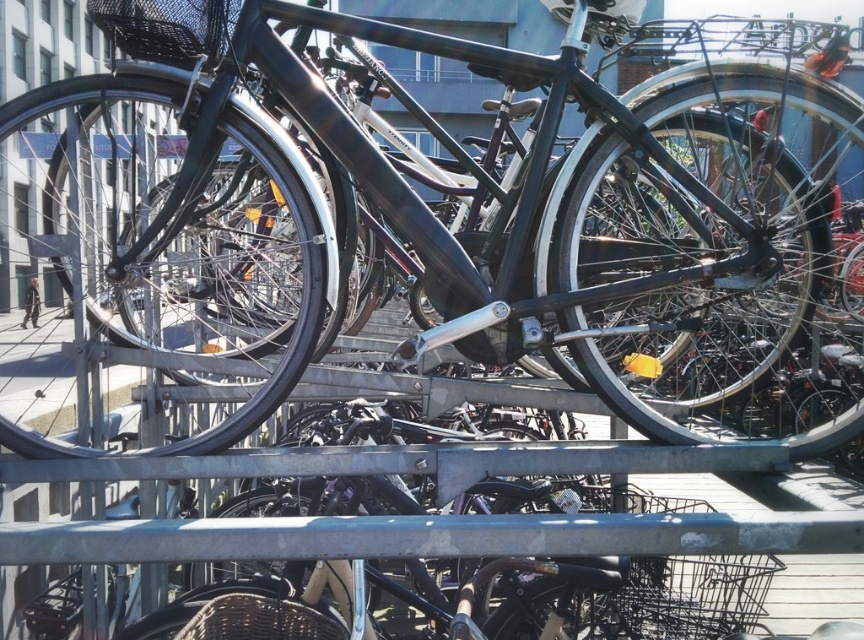
Is black mesh basket at upper left to the left of black woven basket at center from the viewer's perspective?

Yes, black mesh basket at upper left is to the left of black woven basket at center.

Does black mesh basket at upper left come behind black woven basket at center?

No, it is in front of black woven basket at center.

Does point (108, 35) lie in front of point (340, 632)?

Yes, point (108, 35) is in front of point (340, 632).

Where is `black mesh basket at upper left`? This screenshot has height=640, width=864. black mesh basket at upper left is located at coordinates (167, 28).

Between glossy black bicycle at center and black mesh basket at upper left, which one appears on the right side from the viewer's perspective?

Positioned to the right is glossy black bicycle at center.

Who is more distant from viewer, [236,20] or [223,38]?

The point [236,20] is more distant.

Between point (758, 260) and point (176, 45), which one is positioned in front?

Point (758, 260) is in front.

You are a GUI agent. You are given a task and a screenshot of the screen. Output one action in this format:
    pyautogui.click(x=<x>, y=<y>)
    Task: Click on the glossy black bicycle at center
    
    Given the screenshot: What is the action you would take?
    pyautogui.click(x=602, y=218)

Does point (640, 124) lie behind point (216, 616)?

No, (640, 124) is closer to viewer.

Which is in front, point (704, 365) or point (255, 621)?

Point (255, 621)

You are a GUI agent. You are given a task and a screenshot of the screen. Output one action in this format:
    pyautogui.click(x=<x>, y=<y>)
    Task: Click on the glossy black bicycle at center
    The width and height of the screenshot is (864, 640).
    Given the screenshot: What is the action you would take?
    pyautogui.click(x=602, y=218)